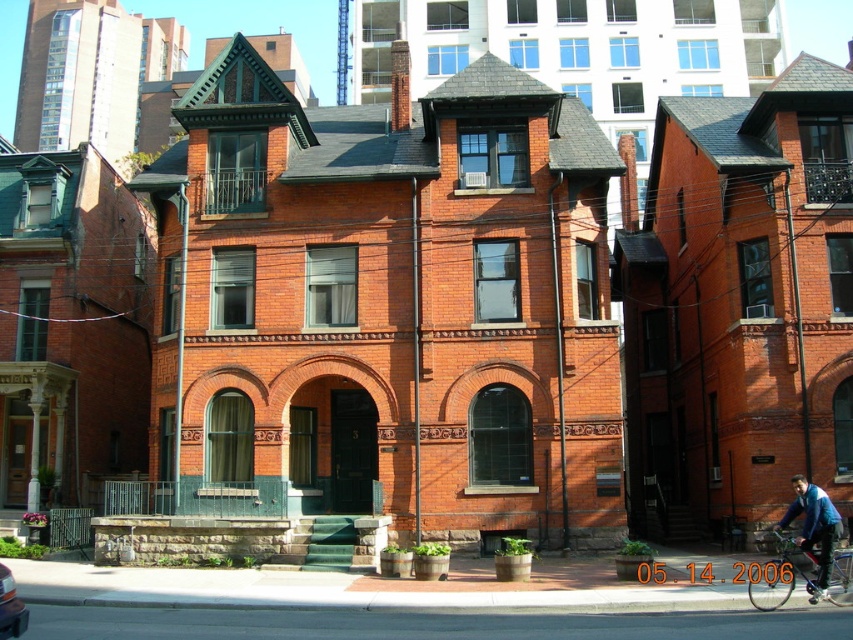
Is metallic blue bicycle at lower right positioned behind metallic silver car at lower left?

Yes, metallic blue bicycle at lower right is further from the viewer.

Can you confirm if metallic blue bicycle at lower right is smaller than metallic silver car at lower left?

Actually, metallic blue bicycle at lower right might be larger than metallic silver car at lower left.

Between point (840, 579) and point (9, 618), which one is positioned behind?

Point (840, 579)

At what (x,y) coordinates should I click in order to perform the action: click on metallic blue bicycle at lower right. Please return your answer as a coordinate pair (x, y). The image size is (853, 640). Looking at the image, I should click on (782, 573).

Between point (827, 577) and point (16, 605), which one is positioned in front?

Point (16, 605) is more forward.

Who is taller, blue denim jacket at lower right or metallic silver car at lower left?

With more height is blue denim jacket at lower right.

Does point (827, 493) lie behind point (0, 584)?

That is True.

Locate an element on the screen. This screenshot has height=640, width=853. blue denim jacket at lower right is located at coordinates (814, 529).

Does metallic blue bicycle at lower right appear under blue denim jacket at lower right?

Indeed, metallic blue bicycle at lower right is positioned under blue denim jacket at lower right.

Where is `metallic blue bicycle at lower right`? metallic blue bicycle at lower right is located at coordinates (782, 573).

This screenshot has width=853, height=640. Identify the location of metallic blue bicycle at lower right. click(782, 573).